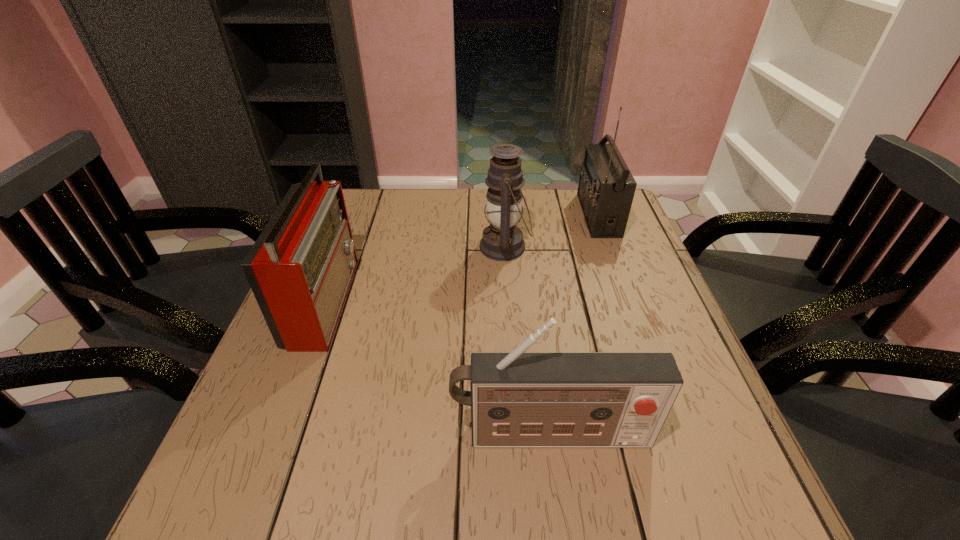
Find the location of `vacant space located on the left of the oil lamp`. vacant space located on the left of the oil lamp is located at coordinates (360, 247).

Find the location of a particular element. free location located 0.090m on the front panel of the nearest radio receiver is located at coordinates click(561, 508).

Find the location of a particular element. free region located on the front-facing side of the second farthest radio receiver is located at coordinates pos(492,299).

The height and width of the screenshot is (540, 960). In order to click on radio receiver present at the far edge in this screenshot , I will do `click(606, 188)`.

The image size is (960, 540). I want to click on oil lamp located at the far edge, so click(x=502, y=240).

I want to click on object present at the left edge, so click(x=300, y=269).

Find the location of a particular element. The height and width of the screenshot is (540, 960). object that is positioned at the far right corner is located at coordinates (606, 188).

Locate an element on the screen. Image resolution: width=960 pixels, height=540 pixels. vacant space at the far edge of the desktop is located at coordinates (443, 226).

Locate an element on the screen. blank space at the near edge of the desktop is located at coordinates tap(310, 501).

Image resolution: width=960 pixels, height=540 pixels. In order to click on blank area at the left edge in this screenshot , I will do `click(267, 393)`.